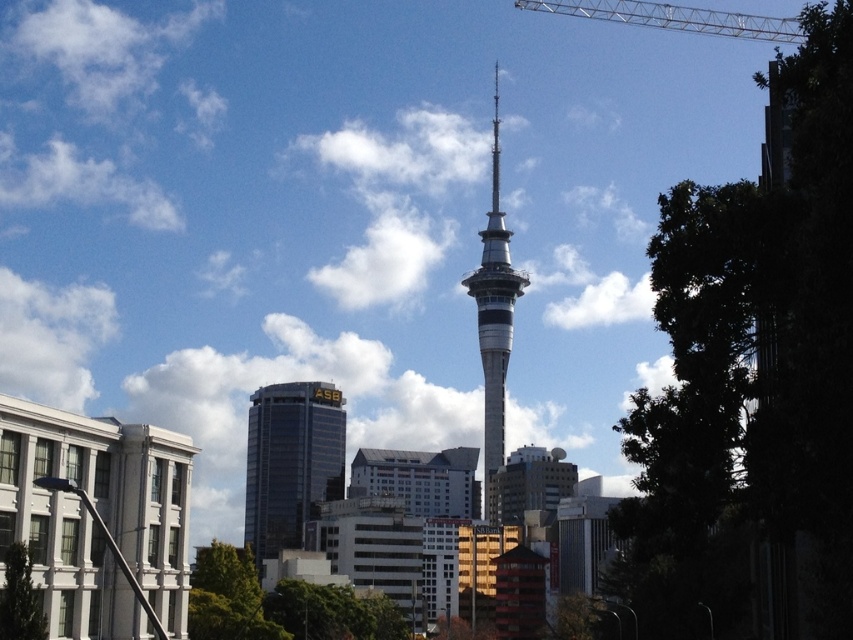
Who is positioned more to the right, silver metallic tower at center or silver metallic crane at upper right?

From the viewer's perspective, silver metallic crane at upper right appears more on the right side.

Is silver metallic tower at center bigger than silver metallic crane at upper right?

Actually, silver metallic tower at center might be smaller than silver metallic crane at upper right.

Is point (485, 474) behind point (556, 12)?

No, (485, 474) is in front of (556, 12).

The width and height of the screenshot is (853, 640). What are the coordinates of `silver metallic tower at center` in the screenshot? It's located at (494, 314).

Who is shorter, shiny glass skyscraper at center or silver metallic crane at upper right?

Standing shorter between the two is silver metallic crane at upper right.

Consider the image. Is shiny glass skyscraper at center to the left of silver metallic crane at upper right from the viewer's perspective?

Correct, you'll find shiny glass skyscraper at center to the left of silver metallic crane at upper right.

Between point (265, 508) and point (709, 17), which one is positioned behind?

Point (709, 17)

I want to click on shiny glass skyscraper at center, so click(291, 461).

Is point (276, 524) positioned behind point (486, 518)?

No, (276, 524) is closer to viewer.

Is shiny glass skyscraper at center wider than silver metallic tower at center?

Yes.

You are a GUI agent. You are given a task and a screenshot of the screen. Output one action in this format:
    pyautogui.click(x=<x>, y=<y>)
    Task: Click on the shiny glass skyscraper at center
    This screenshot has width=853, height=640.
    Given the screenshot: What is the action you would take?
    pyautogui.click(x=291, y=461)